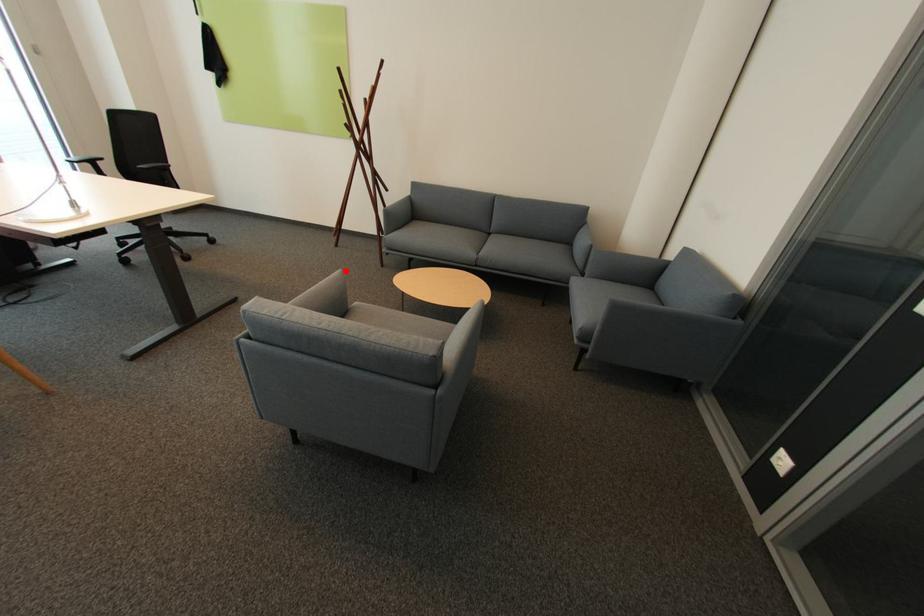
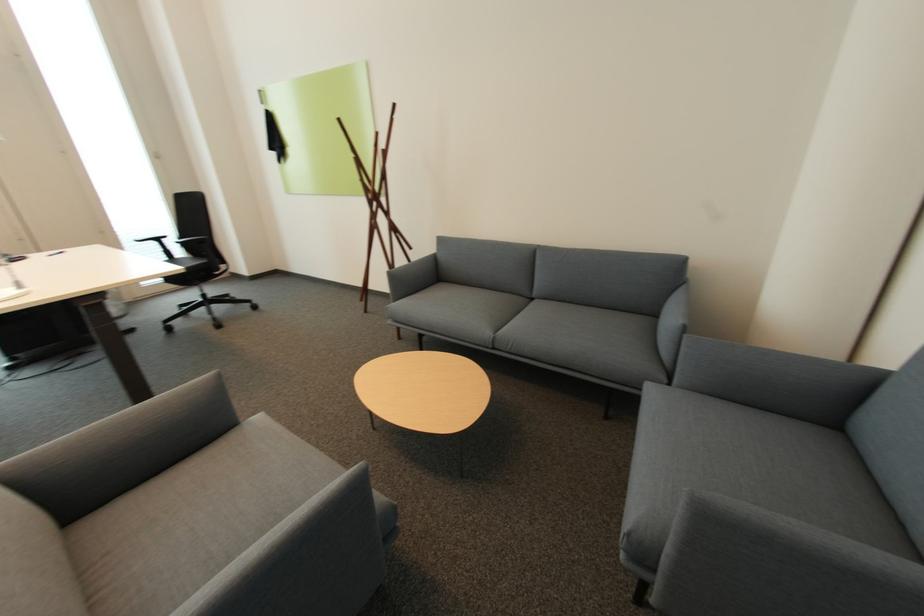
The point at the highlighted location is marked in the first image. Where is the corresponding point in the second image?

(219, 373)